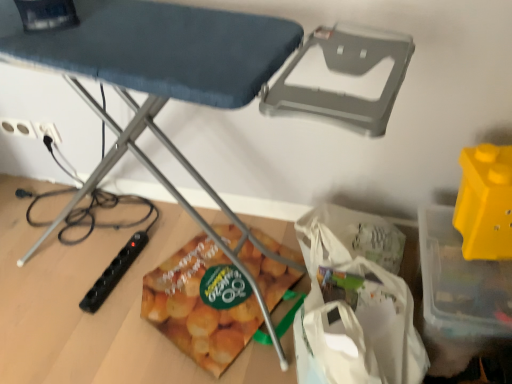
Where is `vacant area that lies between black plastic power strip at lower left, placed as the second toy when sorted from right to left, and matte plastic snack bag at lower center`? vacant area that lies between black plastic power strip at lower left, placed as the second toy when sorted from right to left, and matte plastic snack bag at lower center is located at coordinates (142, 282).